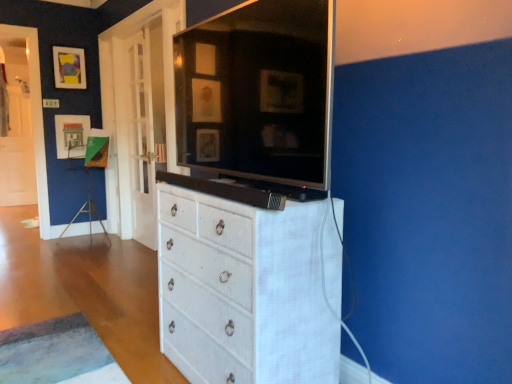
Question: Can you confirm if white textured cabinet at center is thinner than matte black picture frame at upper left, which is the 2th picture frame from bottom to top?

Choices:
 (A) no
 (B) yes

Answer: (A)

Question: Can you confirm if white textured cabinet at center is smaller than matte black picture frame at upper left, marked as the first picture frame in a top-to-bottom arrangement?

Choices:
 (A) yes
 (B) no

Answer: (B)

Question: Does white textured cabinet at center have a lesser height compared to matte black picture frame at upper left, marked as the first picture frame in a top-to-bottom arrangement?

Choices:
 (A) yes
 (B) no

Answer: (B)

Question: From the image's perspective, is white textured cabinet at center located above matte black picture frame at upper left, which is the 2th picture frame from bottom to top?

Choices:
 (A) no
 (B) yes

Answer: (A)

Question: From a real-world perspective, is white textured cabinet at center located higher than matte black picture frame at upper left, marked as the first picture frame in a top-to-bottom arrangement?

Choices:
 (A) yes
 (B) no

Answer: (B)

Question: Is white textured cabinet at center wider or thinner than white wicker chest of drawers at center?

Choices:
 (A) thin
 (B) wide

Answer: (A)

Question: From a real-world perspective, is white textured cabinet at center positioned above or below white wicker chest of drawers at center?

Choices:
 (A) above
 (B) below

Answer: (A)

Question: Based on their positions, is white textured cabinet at center located to the left or right of white wicker chest of drawers at center?

Choices:
 (A) left
 (B) right

Answer: (A)

Question: Considering the positions of white textured cabinet at center and white wicker chest of drawers at center in the image, is white textured cabinet at center taller or shorter than white wicker chest of drawers at center?

Choices:
 (A) tall
 (B) short

Answer: (B)

Question: Is matte black picture frame at upper left, marked as the first picture frame in a top-to-bottom arrangement, taller or shorter than white wicker chest of drawers at center?

Choices:
 (A) tall
 (B) short

Answer: (B)

Question: Is matte black picture frame at upper left, marked as the first picture frame in a top-to-bottom arrangement, bigger or smaller than white wicker chest of drawers at center?

Choices:
 (A) small
 (B) big

Answer: (A)

Question: Looking at their shapes, would you say matte black picture frame at upper left, marked as the first picture frame in a top-to-bottom arrangement, is wider or thinner than white wicker chest of drawers at center?

Choices:
 (A) thin
 (B) wide

Answer: (A)

Question: Is matte black picture frame at upper left, which is the 2th picture frame from bottom to top, situated inside white wicker chest of drawers at center or outside?

Choices:
 (A) inside
 (B) outside

Answer: (B)

Question: From a real-world perspective, is matte paper picture frame at upper left, which is the second picture frame from top to bottom, positioned above or below white textured cabinet at center?

Choices:
 (A) below
 (B) above

Answer: (A)

Question: Considering the relative positions of matte paper picture frame at upper left, which appears as the first picture frame when ordered from the bottom, and white textured cabinet at center in the image provided, is matte paper picture frame at upper left, which appears as the first picture frame when ordered from the bottom, to the left or to the right of white textured cabinet at center?

Choices:
 (A) left
 (B) right

Answer: (A)